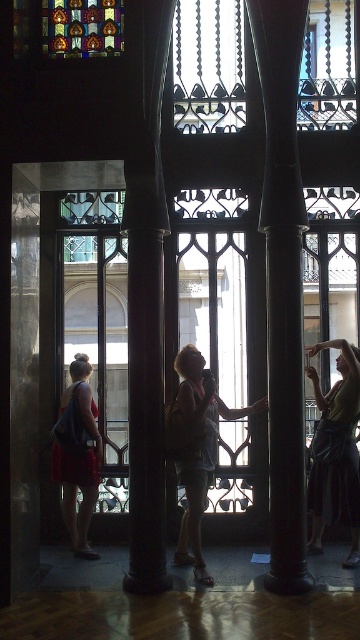
Between matte gray tank top at center and matte red dress at left, which one appears on the left side from the viewer's perspective?

matte red dress at left is more to the left.

Does point (164, 433) lie behind point (78, 365)?

No, it is in front of (78, 365).

Where is `matte gray tank top at center`? The width and height of the screenshot is (360, 640). matte gray tank top at center is located at coordinates point(195,448).

Where is `matte gray tank top at center`? The image size is (360, 640). matte gray tank top at center is located at coordinates (195, 448).

Is green fabric dress at right wider than matte red dress at left?

Yes.

Does point (339, 392) lie behind point (82, 512)?

No, (339, 392) is in front of (82, 512).

Does point (317, 456) come farther from viewer compared to point (68, 458)?

No, (317, 456) is in front of (68, 458).

The height and width of the screenshot is (640, 360). Identify the location of green fabric dress at right. (x=335, y=451).

Can you confirm if matte red dress at left is positioned below stained glass window at upper left?

Indeed, matte red dress at left is positioned under stained glass window at upper left.

You are a GUI agent. You are given a task and a screenshot of the screen. Output one action in this format:
    pyautogui.click(x=<x>, y=<y>)
    Task: Click on the matte red dress at left
    
    Given the screenshot: What is the action you would take?
    pyautogui.click(x=78, y=458)